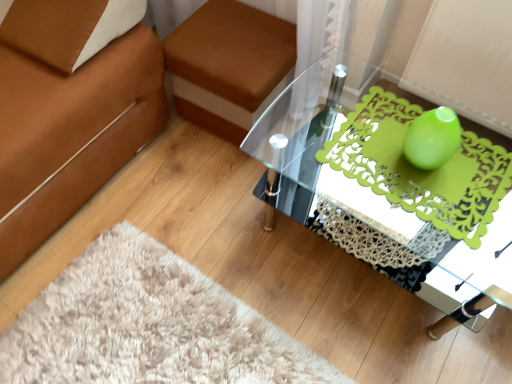
Locate an element on the screen. The image size is (512, 384). free space below green matte vase at upper right (from a real-world perspective) is located at coordinates (419, 169).